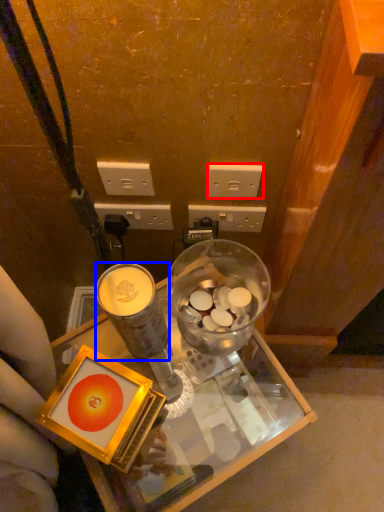
Question: Which object is closer to the camera taking this photo, power outlet (highlighted by a red box) or coffee cup (highlighted by a blue box)?

Choices:
 (A) power outlet
 (B) coffee cup

Answer: (B)